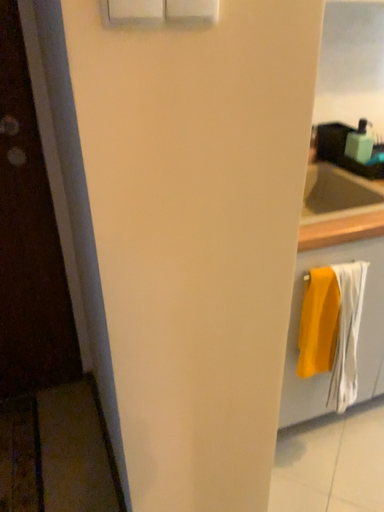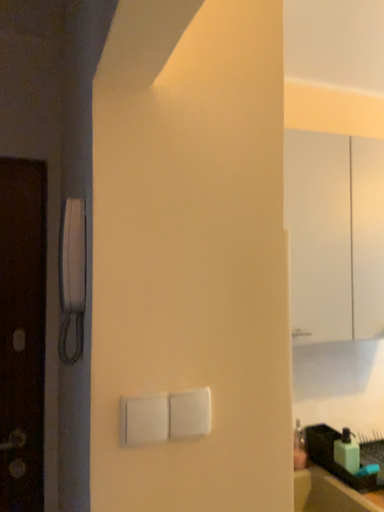
Question: Which way did the camera rotate in the video?

Choices:
 (A) rotated upward
 (B) rotated downward

Answer: (A)